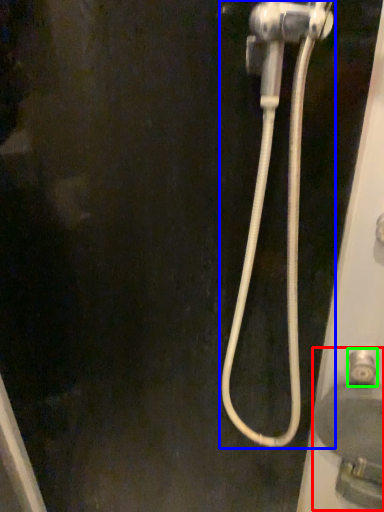
Question: Estimate the real-world distances between objects in this image. Which object is closer to sink (highlighted by a red box), plumbing fixture (highlighted by a blue box) or faucet (highlighted by a green box)?

Choices:
 (A) plumbing fixture
 (B) faucet

Answer: (B)